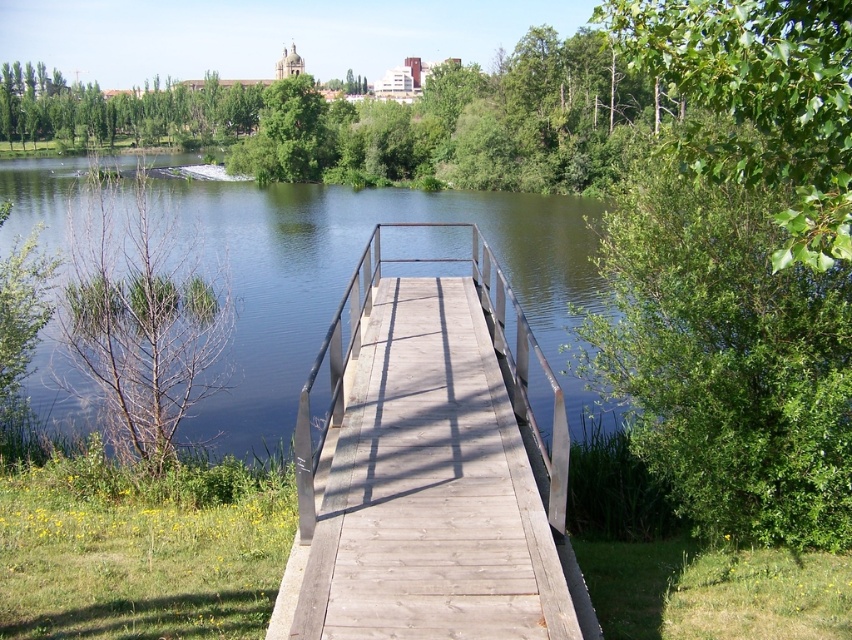
Question: Is wooden dock at center positioned at the back of dark brown water at center?

Choices:
 (A) no
 (B) yes

Answer: (B)

Question: Which object appears farthest from the camera in this image?

Choices:
 (A) wooden dock at center
 (B) dark brown water at center

Answer: (A)

Question: Does wooden dock at center have a smaller size compared to dark brown water at center?

Choices:
 (A) no
 (B) yes

Answer: (B)

Question: Is wooden dock at center below dark brown water at center?

Choices:
 (A) yes
 (B) no

Answer: (A)